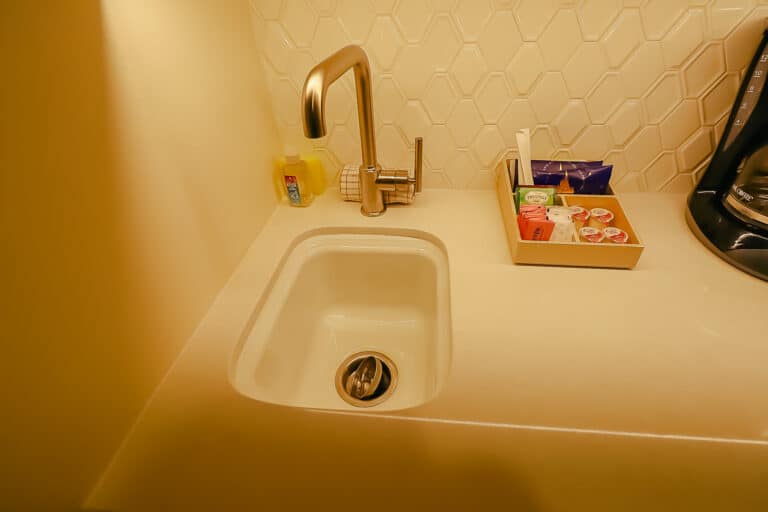
Image resolution: width=768 pixels, height=512 pixels. I want to click on counter top, so click(606, 286).